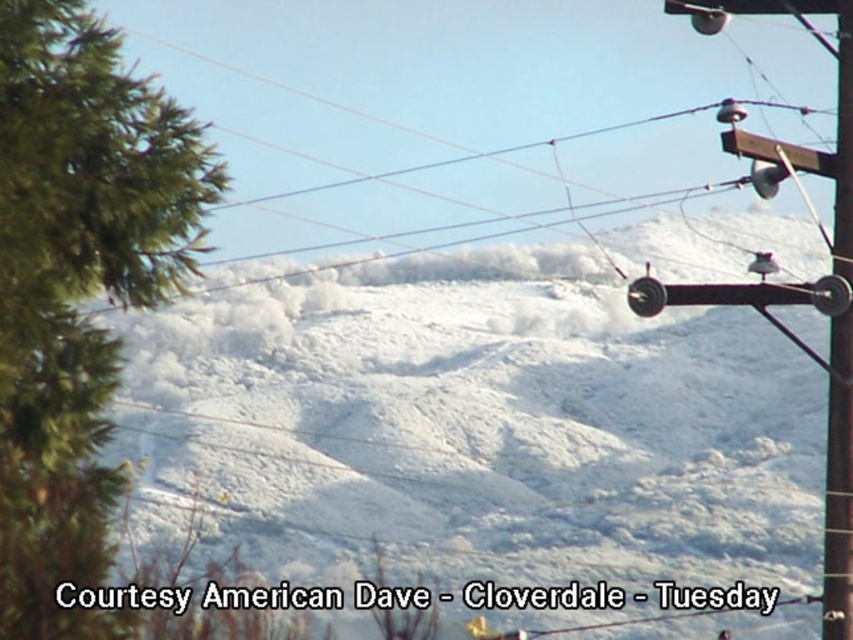
Question: Estimate the real-world distances between objects in this image. Which object is farther from the brown wooden telegraph pole at upper right?

Choices:
 (A) green textured tree at left
 (B) white fluffy snow at center
 (C) metallic wire at upper right

Answer: (C)

Question: Which point is closer to the camera?

Choices:
 (A) (730, 474)
 (B) (115, 380)
 (C) (477, 96)
 (D) (845, 564)

Answer: (B)

Question: Which point is closer to the camera?

Choices:
 (A) pyautogui.click(x=250, y=228)
 (B) pyautogui.click(x=25, y=29)
 (C) pyautogui.click(x=196, y=394)
 (D) pyautogui.click(x=833, y=522)

Answer: (B)

Question: In this image, where is white fluffy snow at center located relative to metallic wire at upper right?

Choices:
 (A) left
 (B) right

Answer: (A)

Question: In this image, where is green textured tree at left located relative to brown wooden telegraph pole at upper right?

Choices:
 (A) above
 (B) below

Answer: (A)

Question: Does metallic wire at upper right have a smaller size compared to brown wooden telegraph pole at upper right?

Choices:
 (A) yes
 (B) no

Answer: (B)